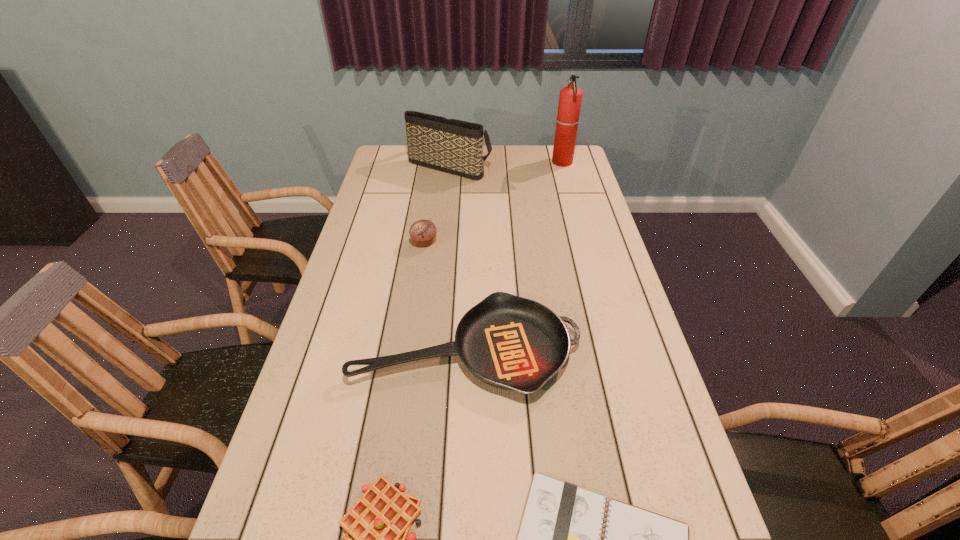
Image resolution: width=960 pixels, height=540 pixels. I want to click on vacant space at the right edge of the desktop, so click(x=677, y=442).

You are a GUI agent. You are given a task and a screenshot of the screen. Output one action in this format:
    pyautogui.click(x=<x>, y=<y>)
    Task: Click on the vacant space at the far left corner
    This screenshot has width=960, height=540.
    Given the screenshot: What is the action you would take?
    pyautogui.click(x=386, y=164)

Identify the location of vacant space at the far right corner of the desktop. (546, 171).

Locate an element on the screen. Image resolution: width=960 pixels, height=540 pixels. vacant space that's between the third shortest object and the third farthest object is located at coordinates (445, 296).

Locate an element on the screen. This screenshot has height=540, width=960. free space between the tallest object and the third farthest object is located at coordinates 493,202.

I want to click on free space between the handbag and the frying pan, so click(458, 257).

Identify the location of vacant region between the third tallest object and the tallest object. The width and height of the screenshot is (960, 540). (493, 202).

Identify the location of object that is the closest to the handbag. This screenshot has width=960, height=540. (570, 98).

Locate an element on the screen. This screenshot has height=540, width=960. the closest object to the third farthest object is located at coordinates (509, 342).

At what (x,y) coordinates should I click in order to perform the action: click on vacant space that satisfies the following two spatial constraints: 1. on the back side of the handbag; 2. on the right side of the third farthest object. Please return your answer as a coordinate pair (x, y). This screenshot has height=540, width=960. Looking at the image, I should click on (436, 165).